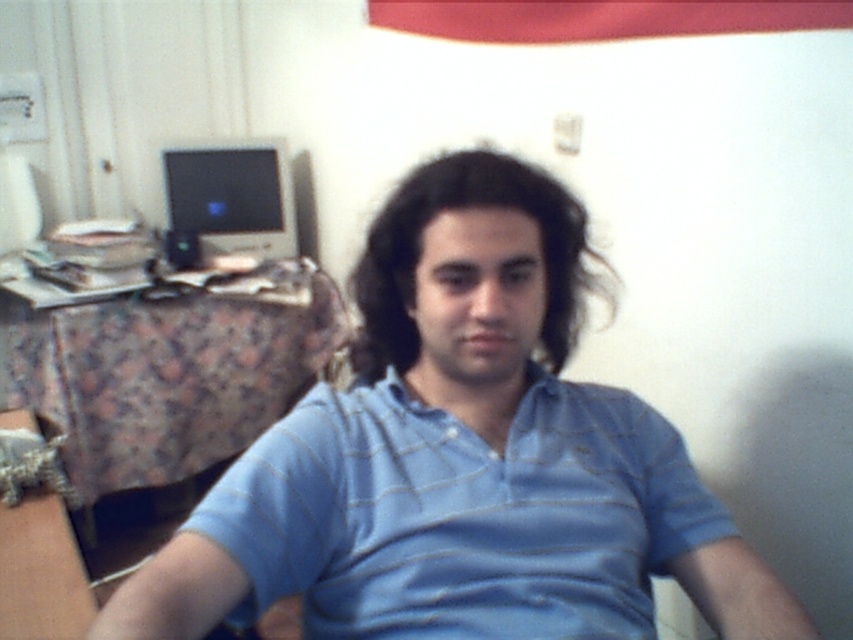
Can you confirm if blue striped polo shirt at center is shorter than dark brown wavy hair at center?

In fact, blue striped polo shirt at center may be taller than dark brown wavy hair at center.

Who is taller, blue striped polo shirt at center or dark brown wavy hair at center?

blue striped polo shirt at center

Measure the distance between blue striped polo shirt at center and camera.

They are 33.53 inches apart.

Locate an element on the screen. blue striped polo shirt at center is located at coordinates (462, 515).

Does blue striped shirt at center have a greater width compared to dark brown wavy hair at center?

Correct, the width of blue striped shirt at center exceeds that of dark brown wavy hair at center.

Is point (254, 602) closer to camera compared to point (390, 252)?

Yes, point (254, 602) is in front of point (390, 252).

The height and width of the screenshot is (640, 853). Describe the element at coordinates (461, 460) in the screenshot. I see `blue striped shirt at center` at that location.

This screenshot has width=853, height=640. I want to click on blue striped shirt at center, so click(461, 460).

Is dark brown wavy hair at center positioned behind matte black monitor at upper left?

That is False.

The image size is (853, 640). Identify the location of dark brown wavy hair at center. (459, 209).